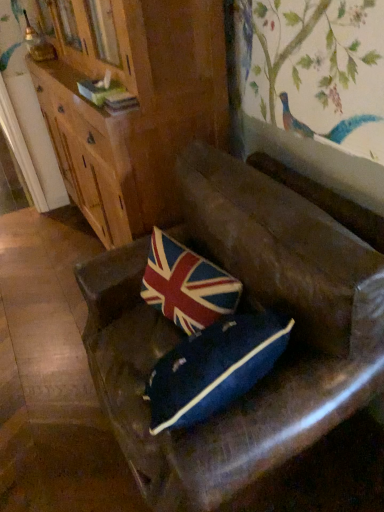
Question: Should I look upward or downward to see leather couch at center?

Choices:
 (A) up
 (B) down

Answer: (B)

Question: From a real-world perspective, is union jack fabric pillow at center located beneath leather couch at center?

Choices:
 (A) no
 (B) yes

Answer: (A)

Question: Is union jack fabric pillow at center touching leather couch at center?

Choices:
 (A) no
 (B) yes

Answer: (A)

Question: Can you confirm if union jack fabric pillow at center is positioned to the left of leather couch at center?

Choices:
 (A) no
 (B) yes

Answer: (B)

Question: Considering the relative positions of union jack fabric pillow at center and leather couch at center in the image provided, is union jack fabric pillow at center behind leather couch at center?

Choices:
 (A) yes
 (B) no

Answer: (A)

Question: Is union jack fabric pillow at center completely or partially outside of leather couch at center?

Choices:
 (A) no
 (B) yes

Answer: (A)

Question: Is union jack fabric pillow at center wider than leather couch at center?

Choices:
 (A) no
 (B) yes

Answer: (A)

Question: Does wooden cabinet at upper left have a greater width compared to union jack fabric pillow at center?

Choices:
 (A) no
 (B) yes

Answer: (B)

Question: Is union jack fabric pillow at center located within wooden cabinet at upper left?

Choices:
 (A) no
 (B) yes

Answer: (A)

Question: Considering the relative sizes of wooden cabinet at upper left and union jack fabric pillow at center in the image provided, is wooden cabinet at upper left shorter than union jack fabric pillow at center?

Choices:
 (A) yes
 (B) no

Answer: (B)

Question: Is wooden cabinet at upper left smaller than union jack fabric pillow at center?

Choices:
 (A) no
 (B) yes

Answer: (A)

Question: From a real-world perspective, does wooden cabinet at upper left sit lower than union jack fabric pillow at center?

Choices:
 (A) no
 (B) yes

Answer: (A)

Question: Is wooden cabinet at upper left behind union jack fabric pillow at center?

Choices:
 (A) no
 (B) yes

Answer: (B)

Question: From the image's perspective, is leather couch at center under union jack fabric pillow at center?

Choices:
 (A) no
 (B) yes

Answer: (B)